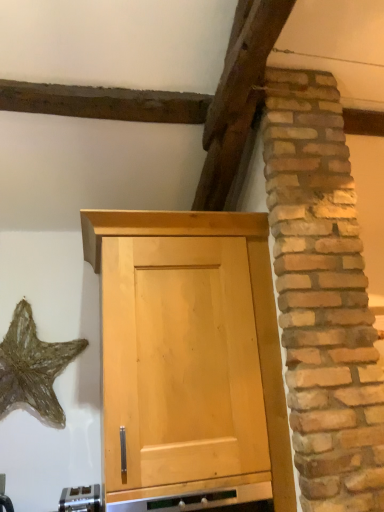
Question: Considering the positions of gold metallic starfish at lower left and light wood cabinet at center in the image, is gold metallic starfish at lower left bigger or smaller than light wood cabinet at center?

Choices:
 (A) big
 (B) small

Answer: (B)

Question: Is gold metallic starfish at lower left taller or shorter than light wood cabinet at center?

Choices:
 (A) short
 (B) tall

Answer: (A)

Question: Which object is positioned farthest from the satin silver toaster at lower center?

Choices:
 (A) gold metallic starfish at lower left
 (B) light wood cabinet at center

Answer: (B)

Question: Which object is the closest to the satin silver toaster at lower center?

Choices:
 (A) gold metallic starfish at lower left
 (B) light wood cabinet at center

Answer: (A)